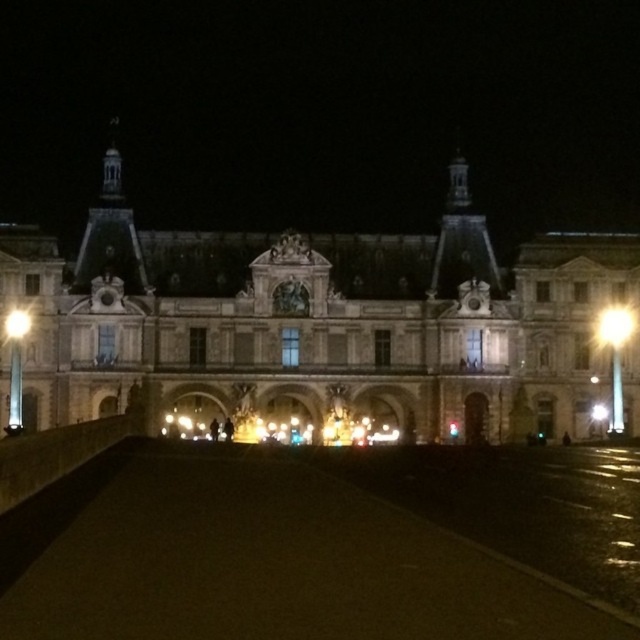
Question: Does bright yellow light at upper right appear on the left side of matte white light at left?

Choices:
 (A) no
 (B) yes

Answer: (A)

Question: Which point is closer to the camera taking this photo?

Choices:
 (A) (628, 316)
 (B) (19, 312)

Answer: (B)

Question: Is bright yellow light at upper right to the right of matte white light at left from the viewer's perspective?

Choices:
 (A) no
 (B) yes

Answer: (B)

Question: Which of the following is the closest to the observer?

Choices:
 (A) bright yellow light at upper right
 (B) matte white light at left

Answer: (B)

Question: Does bright yellow light at upper right have a greater width compared to matte white light at left?

Choices:
 (A) no
 (B) yes

Answer: (B)